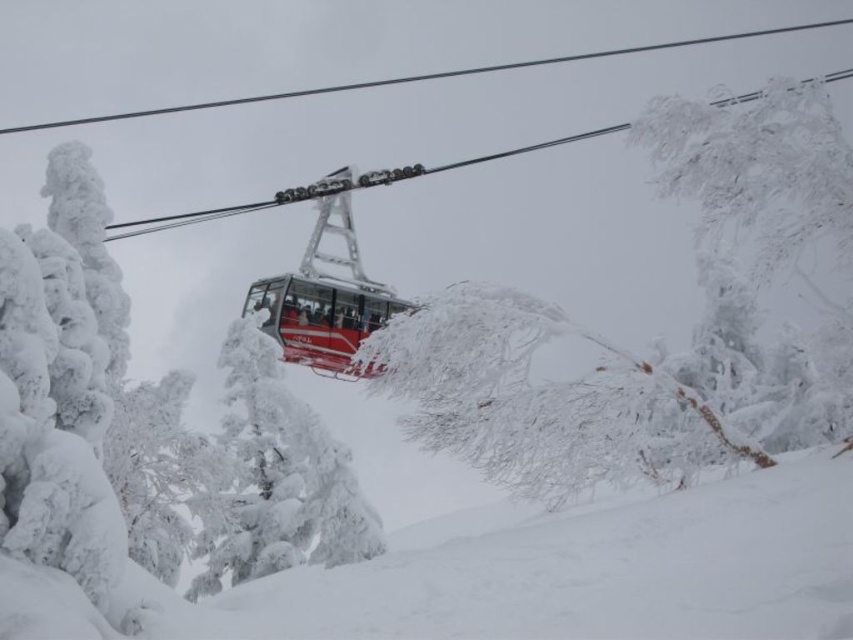
You are a photographer trying to capture the metallic red cable car at center and the white frosty tree at center in the same frame. Based on their sizes in the image, which object would appear closer to the camera?

The metallic red cable car at center appears larger than the white frosty tree at center, so it is closer to the camera.

You are an observer looking at the snowy mountain scene with the red cable car. There are two points marked in the image. The first point is at coordinate point (657, 109) and the second is at point (299, 340). Which of these two points is closer to you as you view the scene?

Point (657, 109) is in front of point (299, 340), so it is closer to you.